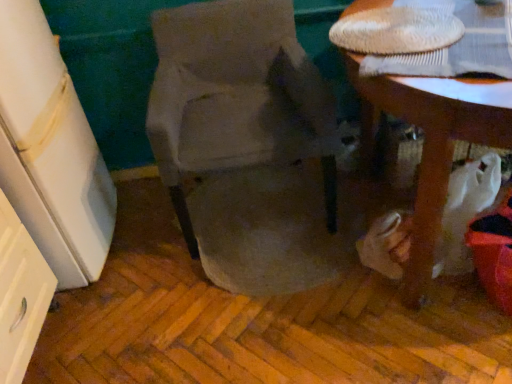
Question: Can we say wooden table at lower right lies outside suede-like beige chair at center?

Choices:
 (A) yes
 (B) no

Answer: (A)

Question: Is wooden table at lower right positioned in front of suede-like beige chair at center?

Choices:
 (A) no
 (B) yes

Answer: (B)

Question: Is suede-like beige chair at center inside wooden table at lower right?

Choices:
 (A) no
 (B) yes

Answer: (A)

Question: From the image's perspective, is wooden table at lower right under suede-like beige chair at center?

Choices:
 (A) yes
 (B) no

Answer: (A)

Question: Is wooden table at lower right oriented away from suede-like beige chair at center?

Choices:
 (A) no
 (B) yes

Answer: (A)

Question: Is point (18, 193) positioned closer to the camera than point (402, 96)?

Choices:
 (A) closer
 (B) farther

Answer: (B)

Question: In terms of height, does white glossy drawer at left look taller or shorter compared to wooden table at lower right?

Choices:
 (A) short
 (B) tall

Answer: (B)

Question: Considering the positions of white glossy drawer at left and wooden table at lower right in the image, is white glossy drawer at left wider or thinner than wooden table at lower right?

Choices:
 (A) wide
 (B) thin

Answer: (B)

Question: From a real-world perspective, is white glossy drawer at left above or below wooden table at lower right?

Choices:
 (A) below
 (B) above

Answer: (B)

Question: Considering the positions of wooden table at lower right and white glossy drawer at left in the image, is wooden table at lower right wider or thinner than white glossy drawer at left?

Choices:
 (A) wide
 (B) thin

Answer: (A)

Question: Is wooden table at lower right inside the boundaries of white glossy drawer at left, or outside?

Choices:
 (A) inside
 (B) outside

Answer: (B)

Question: Does point (474, 135) appear closer or farther from the camera than point (50, 62)?

Choices:
 (A) farther
 (B) closer

Answer: (B)

Question: From a real-world perspective, is wooden table at lower right physically located above or below white glossy drawer at left?

Choices:
 (A) above
 (B) below

Answer: (B)

Question: Considering the positions of wooden table at lower right and suede-like beige chair at center in the image, is wooden table at lower right wider or thinner than suede-like beige chair at center?

Choices:
 (A) wide
 (B) thin

Answer: (A)

Question: Does point (465, 79) appear closer or farther from the camera than point (331, 122)?

Choices:
 (A) closer
 (B) farther

Answer: (A)